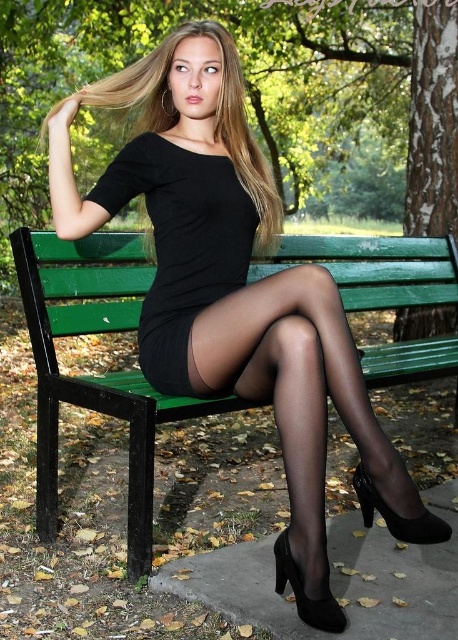
You are a photographer trying to capture the person sitting on the green wooden bench. You notice the black sheer tights at center and the blonde silky hair at upper center. Which object has a smaller width in the image?

The black sheer tights at center has a smaller width than the blonde silky hair at upper center.

You are a fashion designer observing the person in the park. You notice the black sheer tights at center and the black matte dress at center. Which clothing item appears taller on the person?

The black sheer tights at center appears taller than the black matte dress at center.

You are a photographer trying to capture the person sitting on the green wooden bench in the park. You want to ensure that both the black sheer tights at center and the black matte dress at center are clearly visible in your photo. Based on their positions, which item is closer to the bottom of the image?

The black sheer tights at center is located below the black matte dress at center, so it is closer to the bottom of the image.